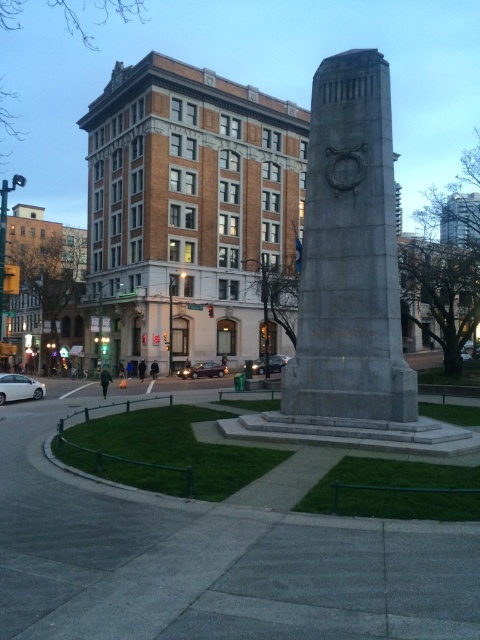
You are a delivery driver who needs to park your vehicle in the parking lot near the monument. Your truck is 15 meters long. You see the white matte car at lower left and the metallic maroon sedan at center. Can you safely park your truck between them without any part of your truck overlapping either vehicle?

The distance between the white matte car at lower left and the metallic maroon sedan at center is 19.29 meters. Since your truck is 15 meters long, there is enough space to park it between them without overlapping either vehicle.

You are a delivery driver who needs to park your white matte car at lower left. The parking spot is located at the point with coordinates (19, 387). Is your car positioned correctly at that spot?

Yes, the point (19, 387) indicates the white matte car at lower left is positioned correctly at that spot.

You are a pedestrian standing at the monument and want to cross the street to reach the metallic maroon sedan at center. Is the white matte car at lower left blocking your path?

The white matte car at lower left is closer to the viewer than the metallic maroon sedan at center, so the white matte car at lower left is blocking your path to the metallic maroon sedan at center.